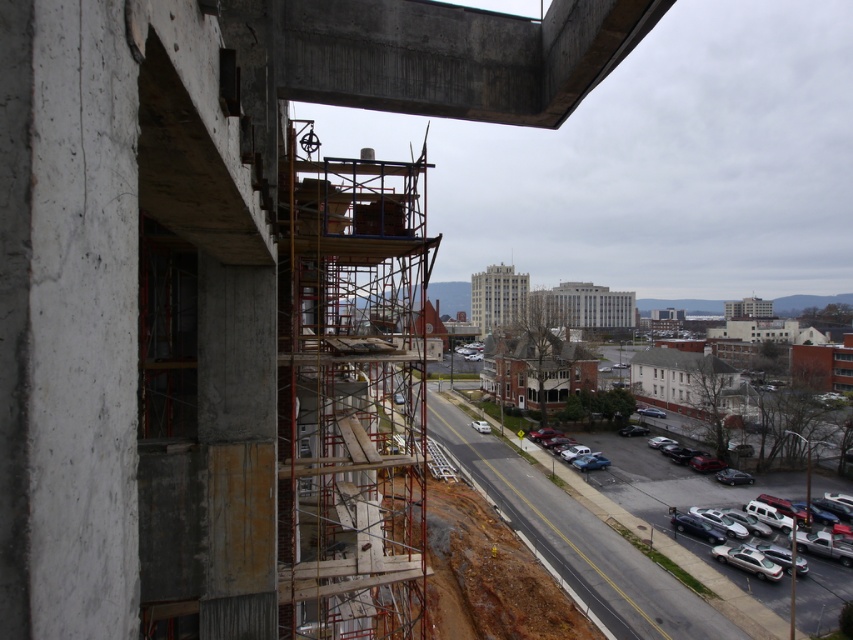
You are a delivery driver needing to navigate through the construction site area. You see the concrete overpass at upper center and the silver metallic sedan at lower right. Which object is nearer to your current position as you approach the site?

The concrete overpass at upper center is closer to the viewer than the silver metallic sedan at lower right, so the concrete overpass at upper center is nearer to your current position.

Based on the photo, you are a delivery driver approaching the construction site and need to navigate under the concrete overpass at upper center. Your truck is 3 meters tall. The silver metallic sedan at lower right, which is parked nearby, has a height of 1.5 meters. Can your truck safely pass under the overpass without hitting it?

The concrete overpass at upper center is shorter than the silver metallic sedan at lower right. Since the sedan is only 1.5 meters tall and the overpass is shorter than that, the overpass height is less than 1.5 meters. However, your truck is 3 meters tall, which is significantly taller than the overpass. This means the truck cannot safely pass under the overpass without hitting it.